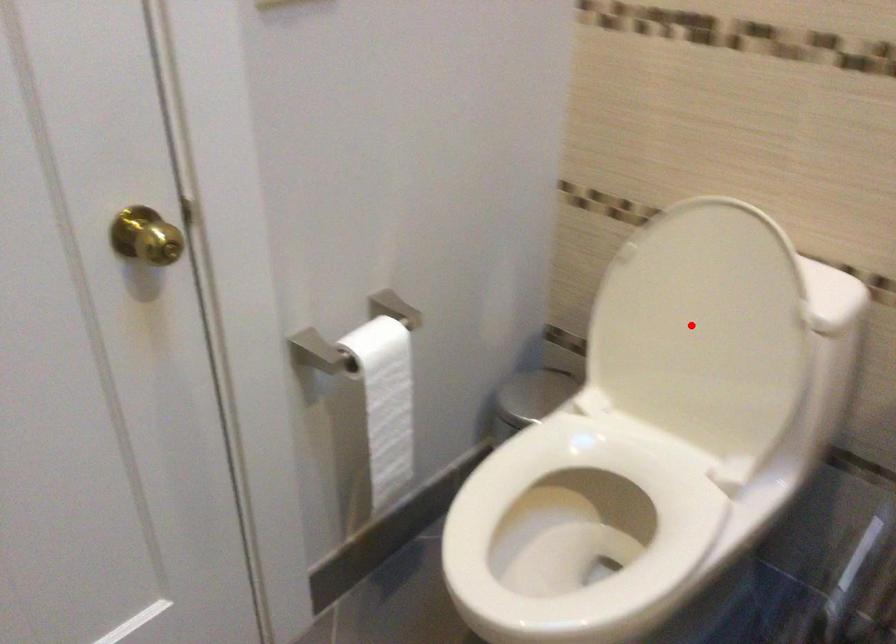
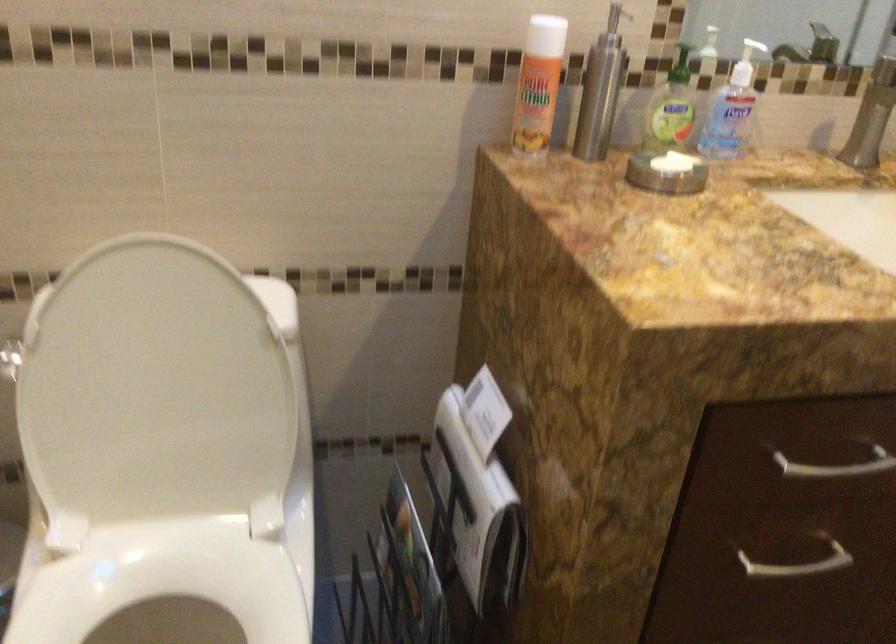
Question: I am providing you with two images of the same scene from different viewpoints. In image1, a red point is highlighted. Considering the same 3D point in image2, which of the following is correct?

Choices:
 (A) It is closer
 (B) It is farther

Answer: (A)